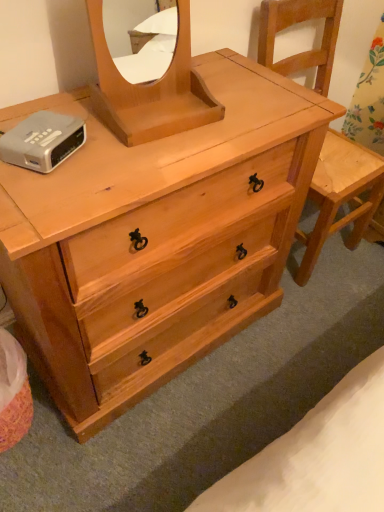
Locate an element on the screen. This screenshot has height=512, width=384. blank space to the left of natural wood mirror at center is located at coordinates (75, 106).